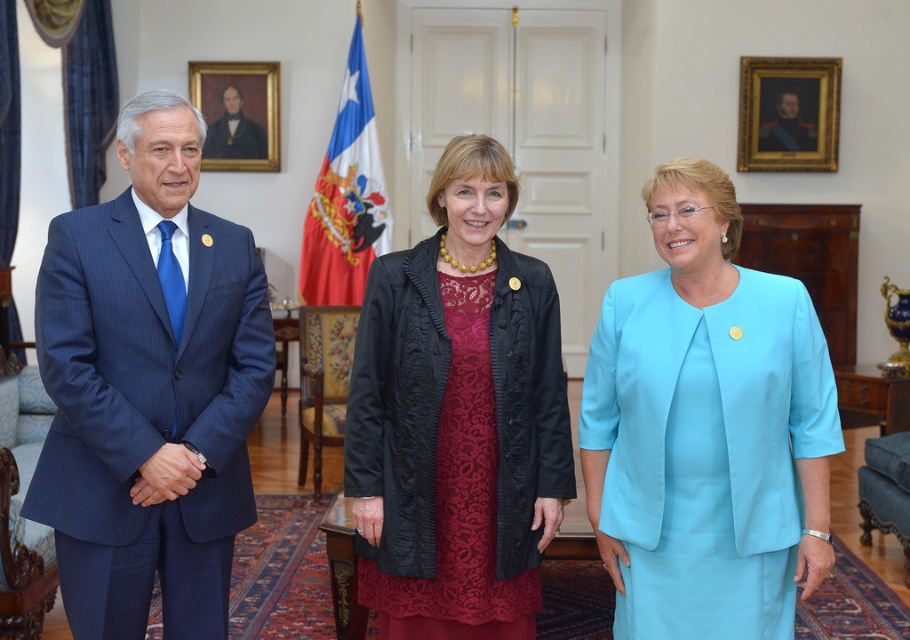
You are an event planner arranging a photo shoot in this room. You need to position a backdrop that must be placed behind the blue pinstripe suit at left and the matte black coat at center. Which object should the backdrop be placed behind to ensure it covers both?

The blue pinstripe suit at left is located above the matte black coat at center, so placing the backdrop behind the blue pinstripe suit at left will ensure it covers both objects since it is positioned higher up.

From the picture: You are a photographer setting up for a group photo. You need to position the blue pinstripe suit at left and the matte black coat at center so that both are clearly visible in the frame. Based on their current positions, which one is closer to the camera?

The blue pinstripe suit at left is closer to the camera because it is in front of the matte black coat at center.

You are a photographer preparing to take a group photo of the individuals in the scene. You need to arrange them so that the narrower suit is on the left side of the frame. Based on the image, is the current arrangement of the blue pinstripe suit at left and light blue satin suit at center already aligned with this requirement?

The blue pinstripe suit at left has a lesser width compared to the light blue satin suit at center. Therefore, the current arrangement already meets the requirement as the narrower suit is positioned on the left side of the frame.